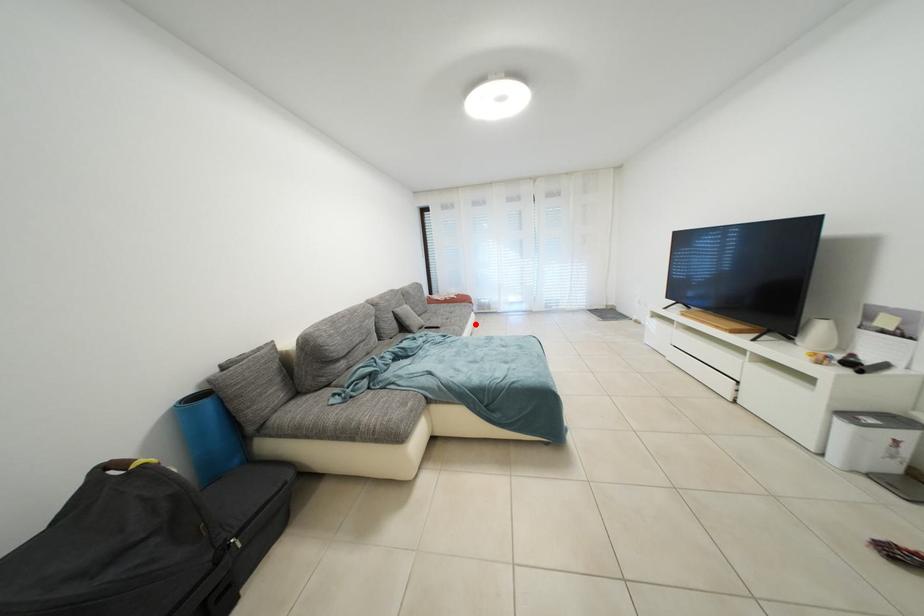
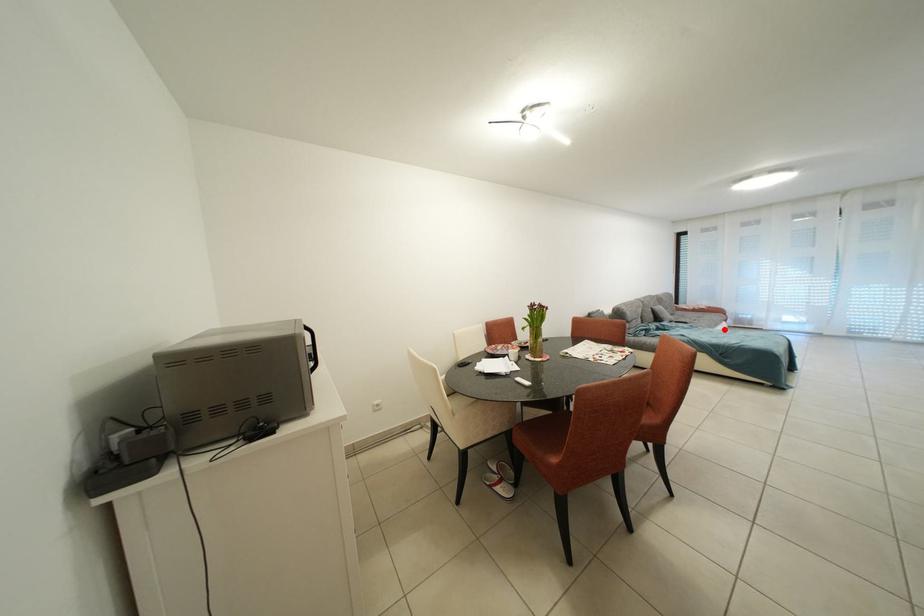
I am providing you with two images of the same scene from different viewpoints. A red point is marked on the first image and another point is marked on the second image. Does the point marked in image1 correspond to the same location as the one in image2?

Yes